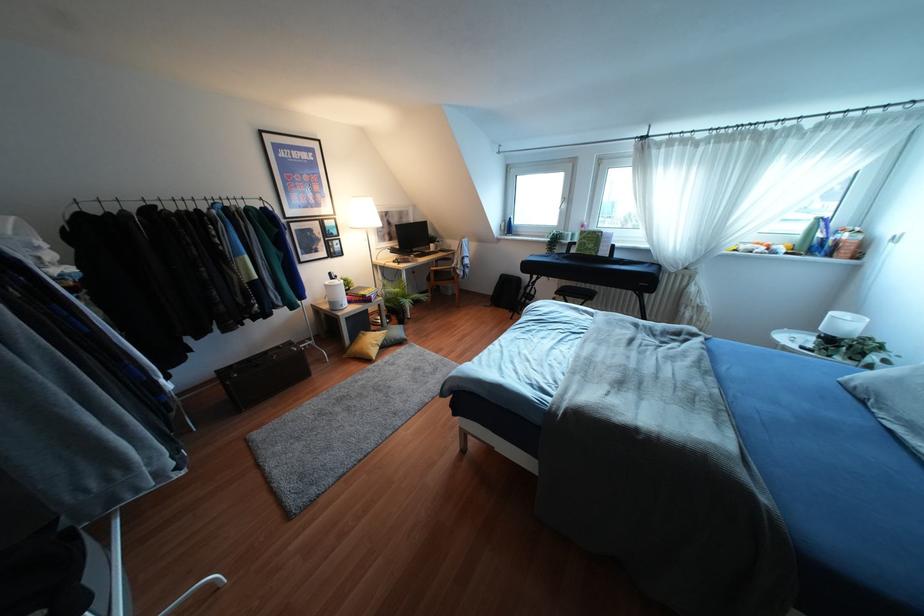
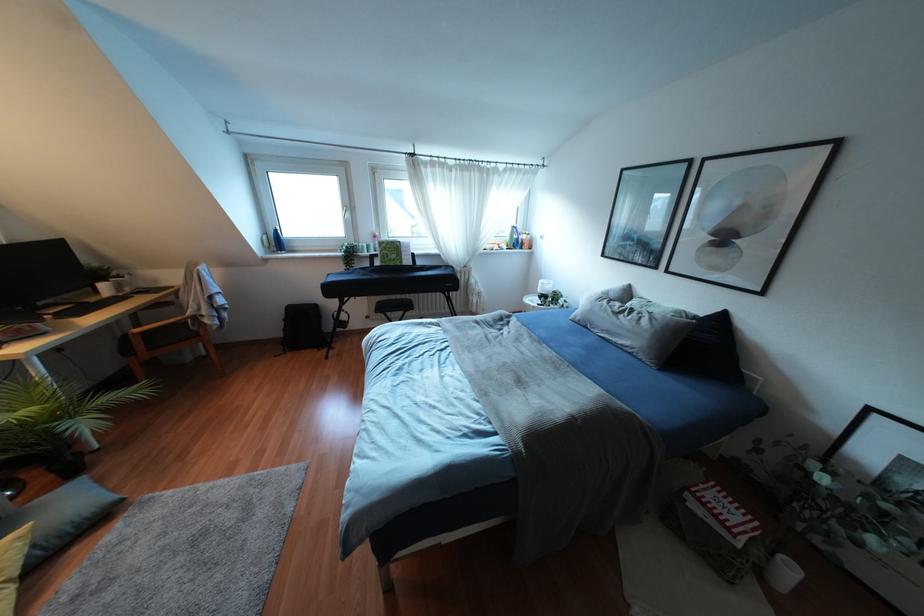
The point at [507,227] is marked in the first image. Where is the corresponding point in the second image?

(275, 241)